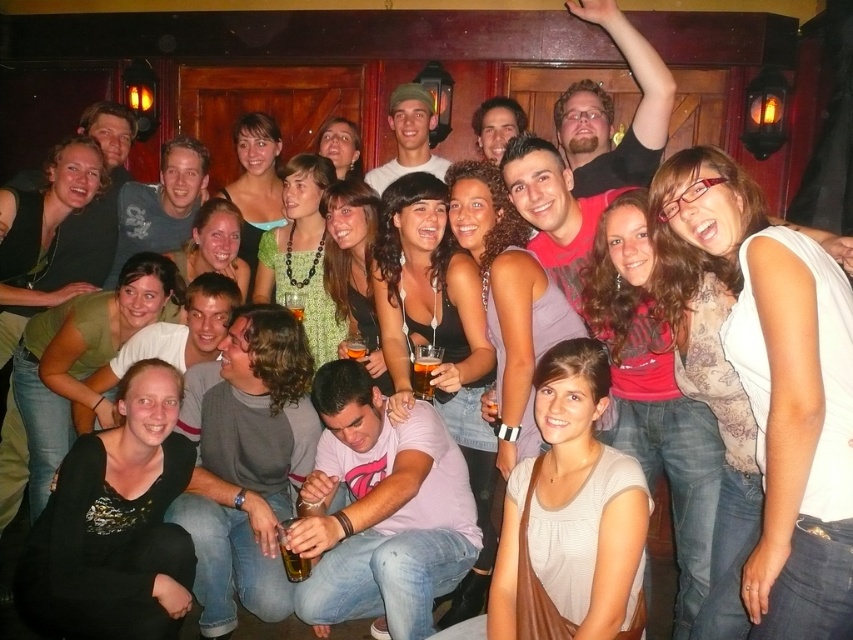
You are standing at the entrance of the bar and want to take a photo that includes both the point at coordinates (x=440, y=353) and the point at coordinates (x=363, y=349). Which point should you focus on first to ensure both are in focus?

You should focus on point (x=363, y=349) first because it is farther from the camera than point (x=440, y=353). By focusing on the farther point, the closer point will also be within the depth of field.

In the scene described, there is a point labeled as point [355,348]. What object in the scene corresponds to this coordinate?

The point [355,348] corresponds to the amber glass beer at center.